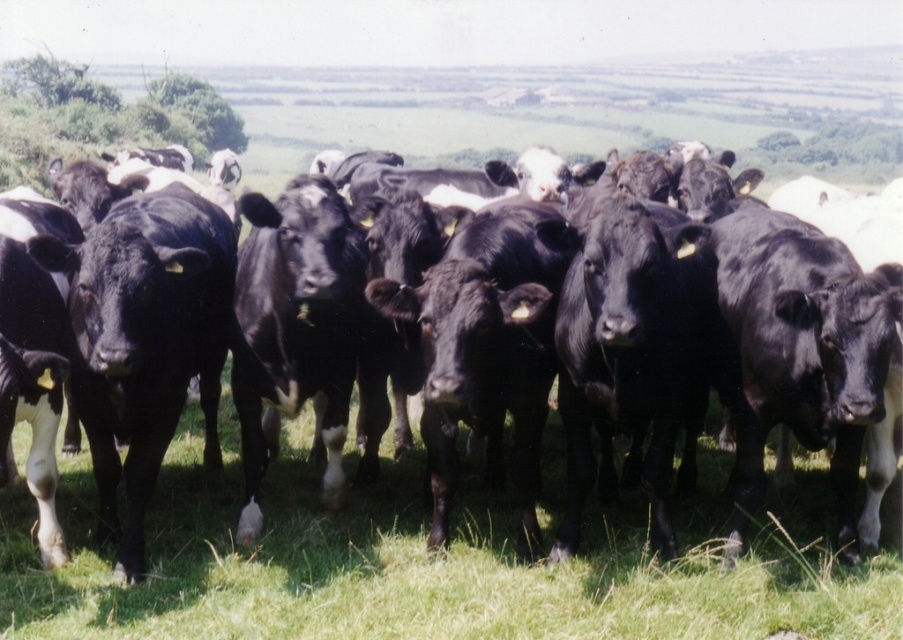
You are a photographer trying to capture the cows in the image. You want to place a marker at point (566, 280) and another at point (592, 577). Which marker will be closer to your camera?

Point (566, 280) is further to the camera than point (592, 577), so the marker at point (566, 280) will be closer to the camera.

You are a farmer who wants to place a new feeding station at point (x=529, y=332) in the field. However, you notice that there is an animal already at that location. Which animal is at that point?

The black glossy cows at center are located at point (x=529, y=332).

You are a farmer checking the pasture. You notice the black glossy cows at center and the green grass at center. Which object is positioned to the right side of the other?

The black glossy cows at center are to the right of green grass at center.